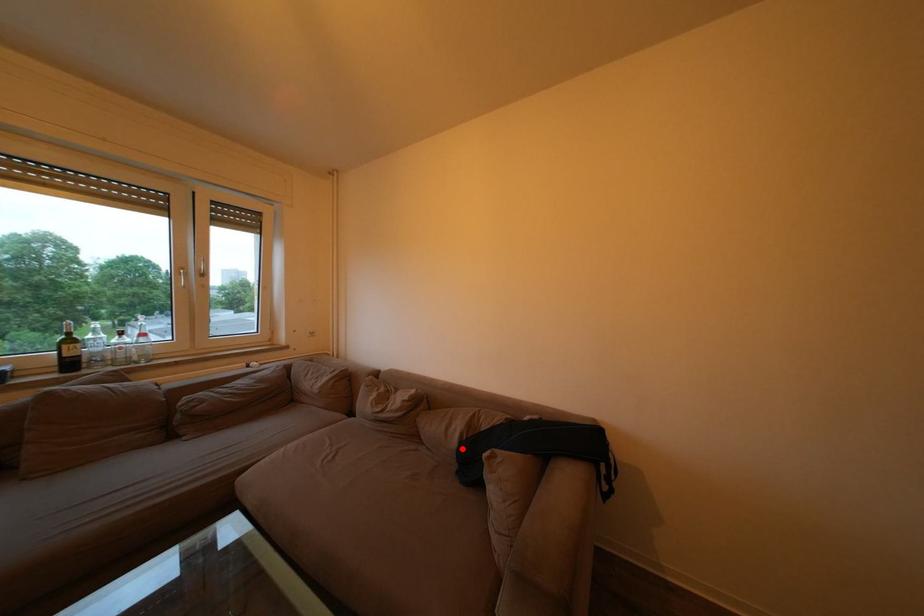
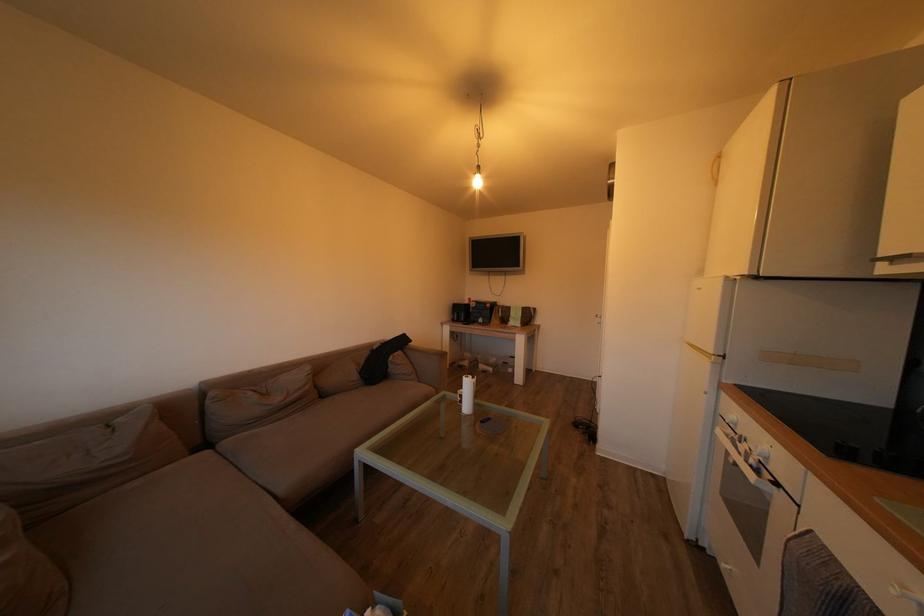
Find the pixel in the second image that matches the highlighted location in the first image.

(362, 382)